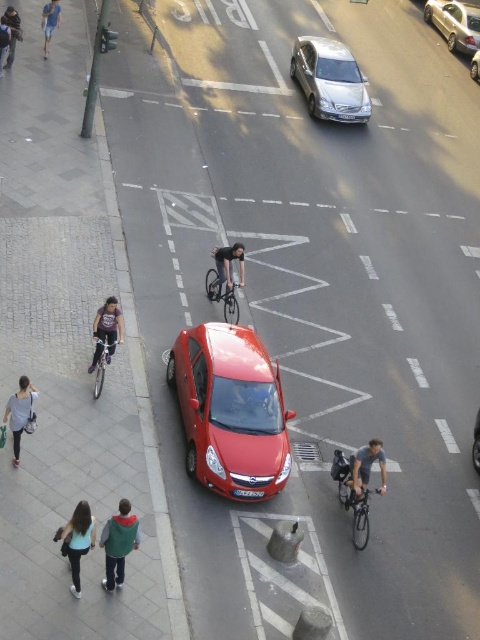
Question: Where is shiny metallic bicycle at lower right located in relation to dark gray hoodie at upper left in the image?

Choices:
 (A) right
 (B) left

Answer: (A)

Question: Does shiny metallic bicycle at lower right appear under dark gray hoodie at upper left?

Choices:
 (A) yes
 (B) no

Answer: (A)

Question: Among these points, which one is farthest from the camera?

Choices:
 (A) (314, 38)
 (B) (108, 362)
 (C) (136, 532)

Answer: (A)

Question: Estimate the real-world distances between objects in this image. Which object is closer to the denim shorts at upper left?

Choices:
 (A) green fleece jacket at lower center
 (B) glossy red car at center
 (C) shiny metallic bicycle at lower left
 (D) shiny metallic bicycle at lower right

Answer: (C)

Question: Can you confirm if denim shorts at upper left is positioned below metallic silver sedan at center?

Choices:
 (A) no
 (B) yes

Answer: (B)

Question: Among these objects, which one is farthest from the camera?

Choices:
 (A) dark gray fabric jacket at upper left
 (B) smooth skin pedestrian at center
 (C) shiny black bicycle at center
 (D) dark gray hoodie at upper left

Answer: (A)